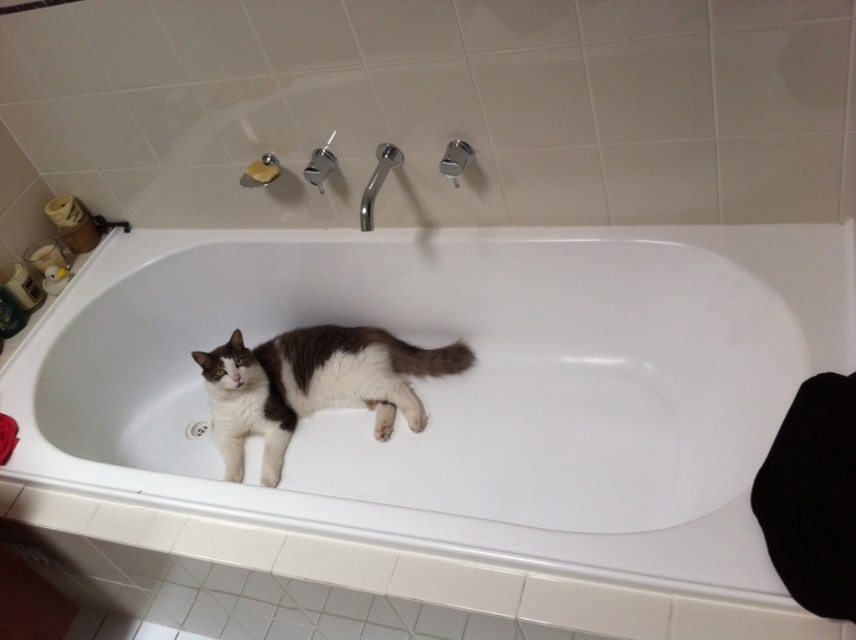
Question: Is white glossy bathtub at center bigger than white fur cat at center?

Choices:
 (A) yes
 (B) no

Answer: (A)

Question: From the image, what is the correct spatial relationship of white glossy bathtub at center in relation to white fur cat at center?

Choices:
 (A) left
 (B) right

Answer: (B)

Question: Is white glossy bathtub at center smaller than white fur cat at center?

Choices:
 (A) no
 (B) yes

Answer: (A)